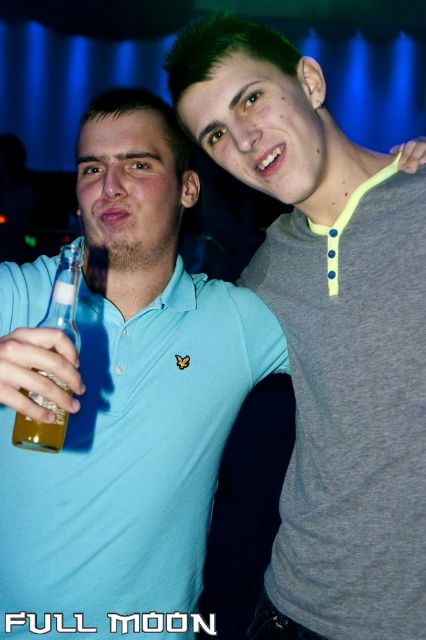
Is matte blue polo shirt at left below gray matte shirt at upper right?

Yes, matte blue polo shirt at left is below gray matte shirt at upper right.

Is matte blue polo shirt at left taller than gray matte shirt at upper right?

No, matte blue polo shirt at left is not taller than gray matte shirt at upper right.

Which is in front, point (109, 339) or point (399, 596)?

Point (399, 596) is more forward.

Locate an element on the screen. matte blue polo shirt at left is located at coordinates pyautogui.click(x=123, y=394).

Is matte blue polo shirt at left bigger than translucent glass bottle at left?

Yes.

Who is more distant from viewer, (60, 534) or (71, 273)?

The point (60, 534) is more distant.

Locate an element on the screen. This screenshot has height=640, width=426. matte blue polo shirt at left is located at coordinates (123, 394).

Is gray matte shirt at upper right above translucent glass bottle at left?

No.

The width and height of the screenshot is (426, 640). Identify the location of gray matte shirt at upper right. (327, 332).

Which is behind, point (287, 202) or point (66, 259)?

The point (287, 202) is behind.

The width and height of the screenshot is (426, 640). In order to click on gray matte shirt at upper right in this screenshot , I will do `click(327, 332)`.